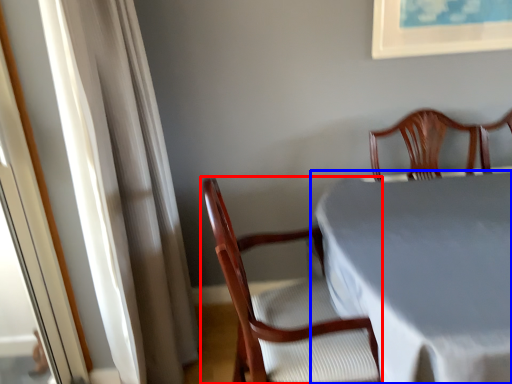
Question: Which of the following is the closest to the observer, chair (highlighted by a red box) or table (highlighted by a blue box)?

Choices:
 (A) chair
 (B) table

Answer: (B)